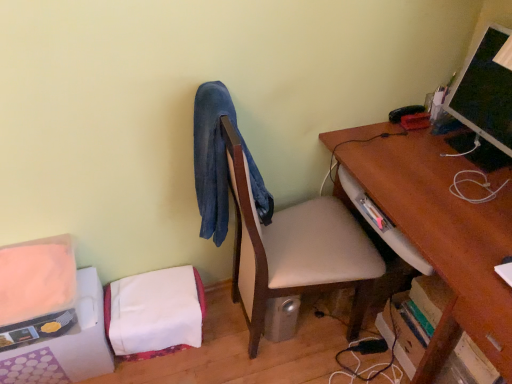
Question: Is matte black monitor at upper right wider or thinner than white fabric at lower left?

Choices:
 (A) thin
 (B) wide

Answer: (A)

Question: In the image, is matte black monitor at upper right on the left side or the right side of white fabric at lower left?

Choices:
 (A) left
 (B) right

Answer: (B)

Question: Which object is positioned closest to the denim jacket at left?

Choices:
 (A) brown wood desk at right
 (B) white fabric at lower left
 (C) wooden desk at center-right
 (D) matte black monitor at upper right

Answer: (C)

Question: Estimate the real-world distances between objects in this image. Which object is closer to the white fabric at lower left?

Choices:
 (A) matte black monitor at upper right
 (B) brown wood desk at right
 (C) denim jacket at left
 (D) wooden desk at center-right

Answer: (C)